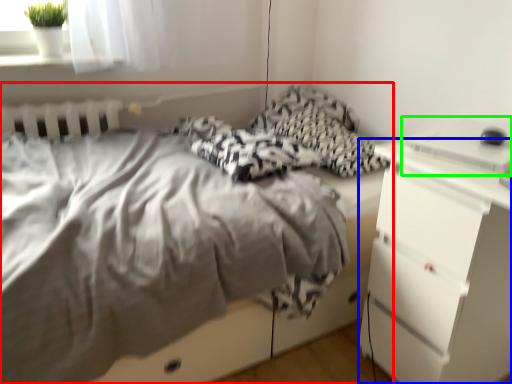
Question: Considering the real-world distances, which object is farthest from bed (highlighted by a red box)? chest of drawers (highlighted by a blue box) or desktop (highlighted by a green box)?

Choices:
 (A) chest of drawers
 (B) desktop

Answer: (B)